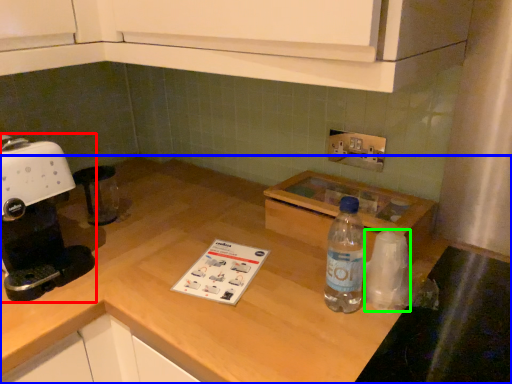
Question: Estimate the real-world distances between objects in this image. Which object is closer to home appliance (highlighted by a red box), countertop (highlighted by a blue box) or paper towel (highlighted by a green box)?

Choices:
 (A) countertop
 (B) paper towel

Answer: (A)